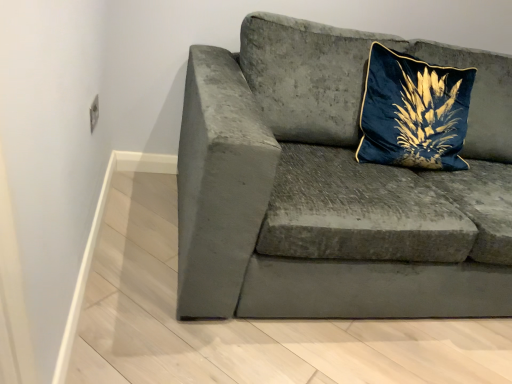
Locate an element on the screen. This screenshot has height=384, width=512. velvet gray couch at center is located at coordinates (334, 186).

Describe the element at coordinates (334, 186) in the screenshot. The image size is (512, 384). I see `velvet gray couch at center` at that location.

You are a GUI agent. You are given a task and a screenshot of the screen. Output one action in this format:
    pyautogui.click(x=<x>, y=<y>)
    Task: Click on the velvet gray couch at center
    The height and width of the screenshot is (384, 512).
    Given the screenshot: What is the action you would take?
    pyautogui.click(x=334, y=186)